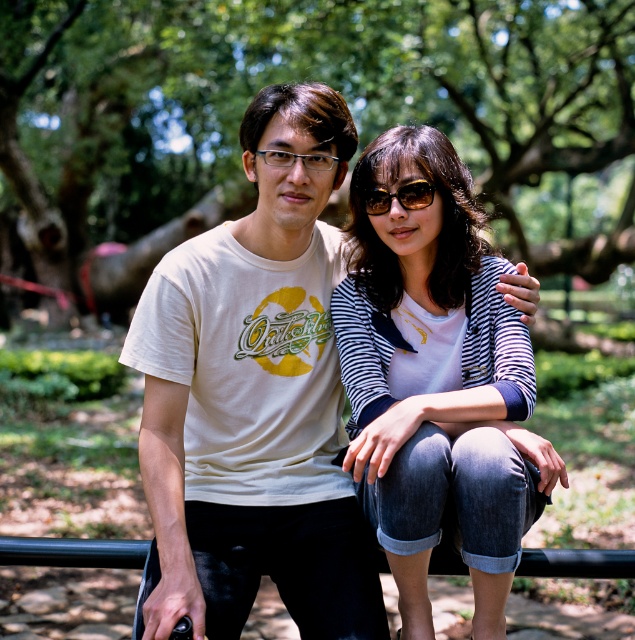
Is white cotton t-shirt at center to the right of clear plastic glasses at center from the viewer's perspective?

In fact, white cotton t-shirt at center is to the left of clear plastic glasses at center.

Is point (279, 173) positioned before point (330, 160)?

That is True.

Is point (144, 632) positioned in front of point (330, 161)?

Yes.

This screenshot has height=640, width=635. What are the coordinates of `white cotton t-shirt at center` in the screenshot? It's located at (254, 401).

Is point (422, 202) less distant than point (271, 161)?

Yes, point (422, 202) is closer to viewer.

Does sunglasses at center appear on the left side of clear plastic glasses at center?

Incorrect, sunglasses at center is not on the left side of clear plastic glasses at center.

Identify the location of sunglasses at center. (398, 196).

In order to click on sunglasses at center in this screenshot , I will do `click(398, 196)`.

Consider the image. Is green leafy tree at center above white cotton t-shirt at center?

Yes.

Does point (20, 250) come farther from viewer compared to point (229, 323)?

Yes.

Which is in front, point (17, 113) or point (302, 90)?

Point (302, 90) is in front.

At what (x,y) coordinates should I click in order to perform the action: click on green leafy tree at center. Please return your answer as a coordinate pair (x, y). Looking at the image, I should click on (298, 77).